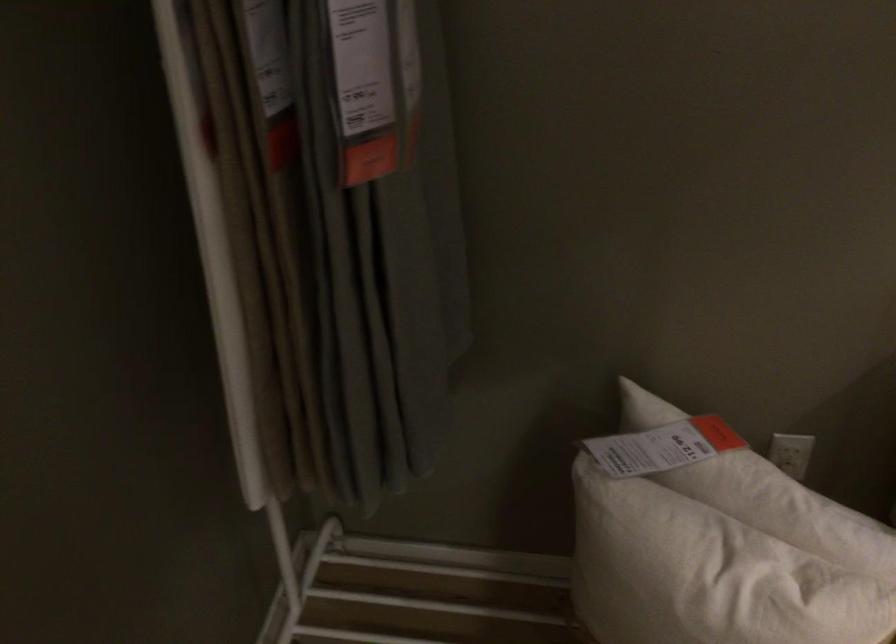
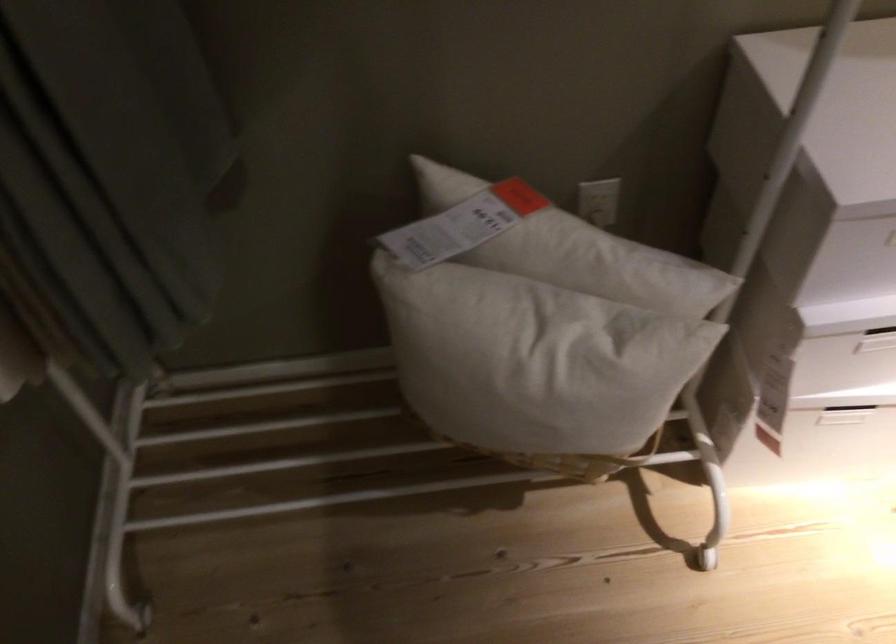
Where in the second image is the point corresponding to (x=770, y=494) from the first image?

(572, 249)